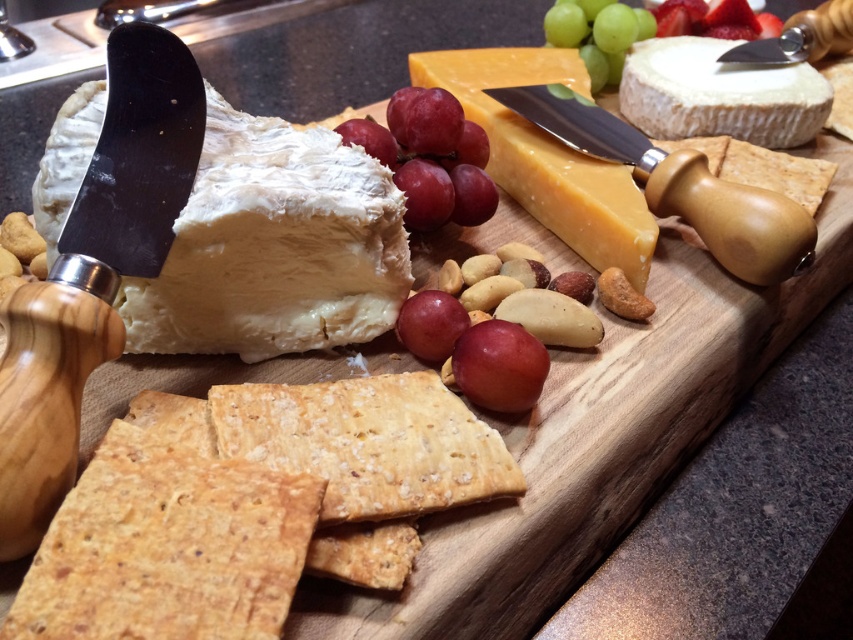
You are a food stylist arranging items on a wooden cheese board. You need to place a new item at the exact center of the board. However, there is already a cluster of red matte grapes at center marked by point (430, 157). Can you place your new item at the board center without overlapping the grapes?

The red matte grapes at center are already located at the exact center point (430, 157) of the board, so you cannot place the new item there without overlapping them.

You are arranging a cheese platter and want to ensure proper spacing between the red matte grape at center and the green matte grape at upper center. Which grape requires more space horizontally?

The green matte grape at upper center requires more horizontal space because its width is greater than the red matte grape at center.